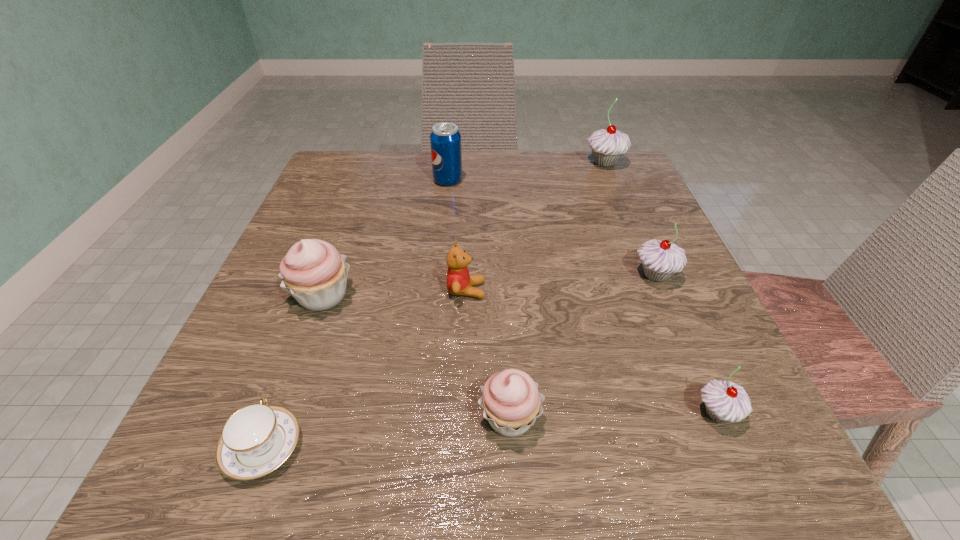
You are a GUI agent. You are given a task and a screenshot of the screen. Output one action in this format:
    pyautogui.click(x=<x>, y=<y>)
    Task: Click on the vacant area between the pop soda and the farthest gray cupcake
    The image size is (960, 540).
    Given the screenshot: What is the action you would take?
    526,172

In order to click on blank region between the shortest object and the farthest cupcake in this screenshot , I will do `click(434, 305)`.

Image resolution: width=960 pixels, height=540 pixels. What are the coordinates of `vacant area that lies between the red teddy bear and the farther pink cupcake` in the screenshot? It's located at (395, 293).

Identify the location of free space between the bigger pink cupcake and the smaller pink cupcake. (416, 357).

Image resolution: width=960 pixels, height=540 pixels. Find the location of `free spot between the biggest gray cupcake and the fourth cupcake from right to left`. free spot between the biggest gray cupcake and the fourth cupcake from right to left is located at coordinates (557, 290).

The image size is (960, 540). Find the location of `object that is the fourth closest to the blue pop soda`. object that is the fourth closest to the blue pop soda is located at coordinates (660, 259).

Select which object appears as the third closest to the biggest gray cupcake. Please provide its 2D coordinates. Your answer should be formatted as a tuple, i.e. [(x, y)], where the tuple contains the x and y coordinates of a point satisfying the conditions above.

[(459, 282)]

Image resolution: width=960 pixels, height=540 pixels. I want to click on cupcake that is the third nearest to the right pink cupcake, so click(660, 259).

Point out which cupcake is positioned as the third nearest to the tallest cupcake. Please provide its 2D coordinates. Your answer should be formatted as a tuple, i.e. [(x, y)], where the tuple contains the x and y coordinates of a point satisfying the conditions above.

[(724, 401)]

Identify which gray cupcake is the closest to the second farthest gray cupcake. Please provide its 2D coordinates. Your answer should be formatted as a tuple, i.e. [(x, y)], where the tuple contains the x and y coordinates of a point satisfying the conditions above.

[(724, 401)]